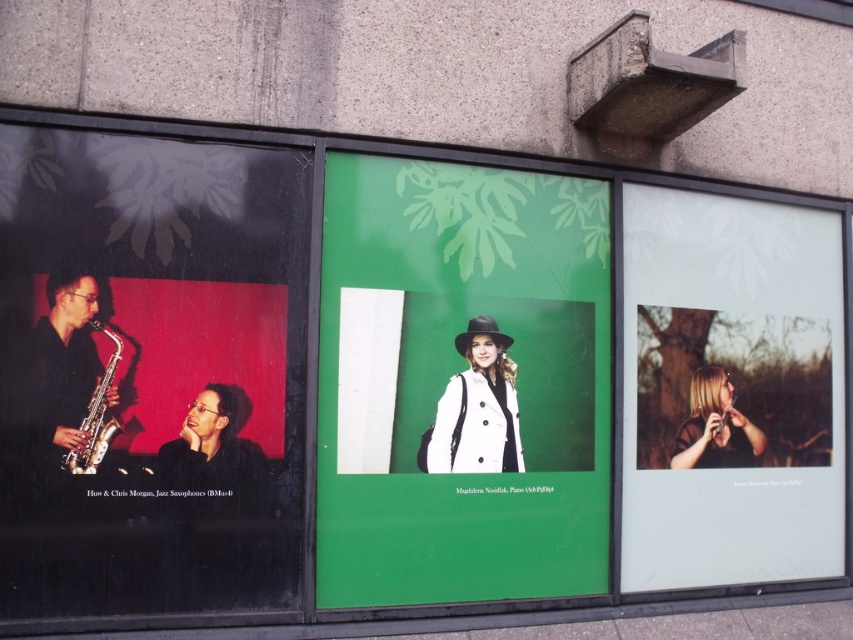
You are a stagehand setting up a performance area. The stage is 2 meters wide. You need to place the matte black saxophone at left and the blonde hair at center on the stage so that they are positioned as in the image. Will the stage be wide enough to accommodate both items with their original spacing?

The distance between the matte black saxophone at left and blonde hair at center is 2.14 meters, which exceeds the stage width of 2 meters. Therefore, the stage is not wide enough to accommodate both items with their original spacing.

From the picture: You are standing in front of the wall with three framed photographs. There are two points marked on the wall, one at point (7, 243) and another at point (705, 372). Which point is closer to your eyes?

Point (7, 243) is closer to the viewer than point (705, 372).

You are an interior designer assessing the wall layout. The matte black saxophone at left and the translucent glass portrait at right are part of the decor. Which object has a greater width when viewed from the front?

The translucent glass portrait at right has a greater width than the matte black saxophone at left when viewed from the front, as the description states the saxophone is thinner.